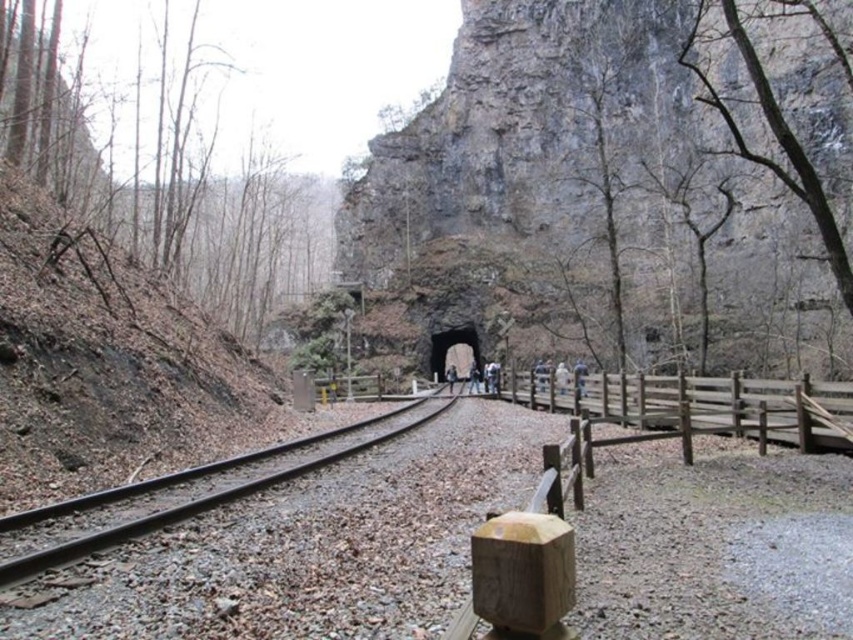
Question: Is gray rock formation at center thinner than smooth metal train track at center?

Choices:
 (A) no
 (B) yes

Answer: (A)

Question: Which point is closer to the camera?

Choices:
 (A) gray rock formation at center
 (B) smooth metal train track at center

Answer: (B)

Question: Which point is closer to the camera?

Choices:
 (A) (358, 241)
 (B) (15, 576)

Answer: (B)

Question: Is gray rock formation at center wider than smooth metal train track at center?

Choices:
 (A) yes
 (B) no

Answer: (A)

Question: Is gray rock formation at center thinner than smooth metal train track at center?

Choices:
 (A) yes
 (B) no

Answer: (B)